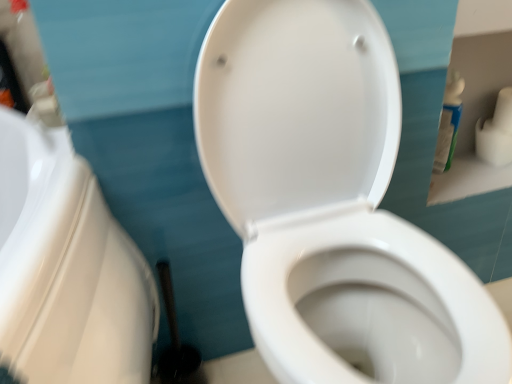
Describe the element at coordinates (331, 203) in the screenshot. I see `white glossy toilet at center` at that location.

The image size is (512, 384). What do you see at coordinates (449, 122) in the screenshot? I see `white plastic bottle at upper right` at bounding box center [449, 122].

You are a GUI agent. You are given a task and a screenshot of the screen. Output one action in this format:
    pyautogui.click(x=<x>, y=<y>)
    Task: Click on the white glossy toilet at center
    The width and height of the screenshot is (512, 384).
    Given the screenshot: What is the action you would take?
    pyautogui.click(x=331, y=203)

What's the angular difference between white glossy toilet at center and white matte toilet paper at upper right's facing directions?

1.42 degrees.

Is point (396, 265) positioned in front of point (507, 99)?

That is True.

Is white glossy toilet at center not inside white matte toilet paper at upper right?

Yes.

From the picture: Who is taller, white glossy toilet at center or white matte toilet paper at upper right?

white glossy toilet at center is taller.

Where is `toilet paper above the white plastic bottle at upper right (from a real-world perspective)`? toilet paper above the white plastic bottle at upper right (from a real-world perspective) is located at coordinates (496, 132).

From a real-world perspective, is white plastic bottle at upper right below white matte toilet paper at upper right?

Yes, from a real-world perspective, white plastic bottle at upper right is beneath white matte toilet paper at upper right.

Is white plastic bottle at upper right wider than white matte toilet paper at upper right?

No.

Is white plastic bottle at upper right taller than white matte toilet paper at upper right?

Yes.

Based on the photo, is white glossy toilet at center positioned with its back to white plastic bottle at upper right?

No, white glossy toilet at center is not facing the opposite direction of white plastic bottle at upper right.

Looking at this image, which point is more forward, (307, 380) or (460, 106)?

The point (307, 380) is in front.

Based on the photo, can you confirm if white glossy toilet at center is smaller than white plastic bottle at upper right?

Incorrect, white glossy toilet at center is not smaller in size than white plastic bottle at upper right.

Looking at their sizes, would you say white glossy toilet at center is wider or thinner than white plastic bottle at upper right?

Considering their sizes, white glossy toilet at center looks broader than white plastic bottle at upper right.

Considering the sizes of white matte toilet paper at upper right and white plastic bottle at upper right in the image, is white matte toilet paper at upper right bigger or smaller than white plastic bottle at upper right?

Clearly, white matte toilet paper at upper right is larger in size than white plastic bottle at upper right.

Which of these two, white matte toilet paper at upper right or white plastic bottle at upper right, stands taller?

white plastic bottle at upper right.

Does point (506, 89) appear closer or farther from the camera than point (459, 115)?

Point (506, 89) is farther from the camera than point (459, 115).

Is white matte toilet paper at upper right oriented away from white plastic bottle at upper right?

No, white plastic bottle at upper right is not at the back of white matte toilet paper at upper right.

Can you confirm if white plastic bottle at upper right is wider than white glossy toilet at center?

No, white plastic bottle at upper right is not wider than white glossy toilet at center.

At what (x,y) coordinates should I click in order to perform the action: click on toilet above the white plastic bottle at upper right (from a real-world perspective). Please return your answer as a coordinate pair (x, y). Image resolution: width=512 pixels, height=384 pixels. Looking at the image, I should click on (331, 203).

Which is behind, point (460, 79) or point (364, 74)?

Positioned behind is point (460, 79).

Measure the distance between white matte toilet paper at upper right and white glossy toilet at center.

The distance of white matte toilet paper at upper right from white glossy toilet at center is 25.90 inches.

Does white matte toilet paper at upper right appear on the left side of white glossy toilet at center?

Incorrect, white matte toilet paper at upper right is not on the left side of white glossy toilet at center.

From their relative heights in the image, would you say white matte toilet paper at upper right is taller or shorter than white glossy toilet at center?

Considering their sizes, white matte toilet paper at upper right has less height than white glossy toilet at center.

Could you tell me if white matte toilet paper at upper right is turned towards white glossy toilet at center?

No, white matte toilet paper at upper right does not turn towards white glossy toilet at center.

In order to click on toilet paper lying above the white glossy toilet at center (from the image's perspective) in this screenshot , I will do `click(496, 132)`.

Identify the location of cleaning product below the white matte toilet paper at upper right (from a real-world perspective). This screenshot has width=512, height=384. point(449,122).

Based on their spatial positions, is white plastic bottle at upper right or white glossy toilet at center closer to white matte toilet paper at upper right?

The object closer to white matte toilet paper at upper right is white plastic bottle at upper right.

Which object lies further to the anchor point white plastic bottle at upper right, white glossy toilet at center or white matte toilet paper at upper right?

The object further to white plastic bottle at upper right is white glossy toilet at center.

Considering their positions, is white glossy toilet at center positioned further to white matte toilet paper at upper right than white plastic bottle at upper right?

white glossy toilet at center is positioned further to the anchor white matte toilet paper at upper right.

Considering their positions, is white matte toilet paper at upper right positioned closer to white glossy toilet at center than white plastic bottle at upper right?

white plastic bottle at upper right lies closer to white glossy toilet at center than the other object.

Based on their spatial positions, is white plastic bottle at upper right or white matte toilet paper at upper right closer to white glossy toilet at center?

Based on the image, white plastic bottle at upper right appears to be nearer to white glossy toilet at center.

Which object lies further to the anchor point white plastic bottle at upper right, white matte toilet paper at upper right or white glossy toilet at center?

white glossy toilet at center is further to white plastic bottle at upper right.

Find the location of a particular element. The height and width of the screenshot is (384, 512). cleaning product between white glossy toilet at center and white matte toilet paper at upper right in the front-back direction is located at coordinates (449, 122).